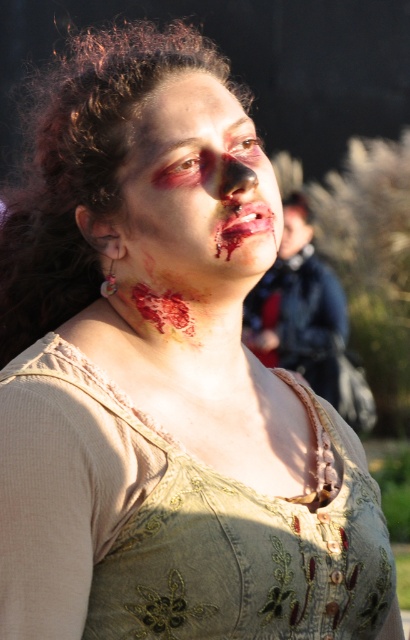
Question: Which point is farther to the camera?

Choices:
 (A) dark curly hair at upper center
 (B) matte flesh-colored nose at center
 (C) blood-stained skin at center
 (D) green embroidered dress at center

Answer: (A)

Question: Which of these objects is positioned closest to the green embroidered dress at center?

Choices:
 (A) blood-stained skin at center
 (B) dark curly hair at upper center

Answer: (A)

Question: Which of these objects is positioned farthest from the green embroidered dress at center?

Choices:
 (A) dark curly hair at upper center
 (B) blood-stained skin at center
 (C) matte flesh-colored nose at center

Answer: (A)

Question: Can you confirm if blood-stained skin at center is positioned above matte flesh-colored nose at center?

Choices:
 (A) no
 (B) yes

Answer: (A)

Question: Is green embroidered dress at center below blood-stained skin at center?

Choices:
 (A) no
 (B) yes

Answer: (B)

Question: Is the position of dark curly hair at upper center less distant than that of blood-stained skin at center?

Choices:
 (A) yes
 (B) no

Answer: (B)